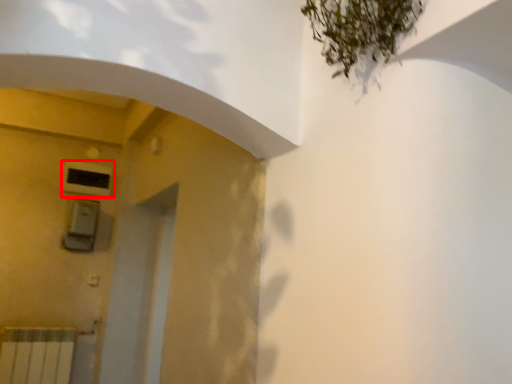
Question: From the image's perspective, where is air conditioning (annotated by the red box) located relative to lift?

Choices:
 (A) above
 (B) below

Answer: (A)